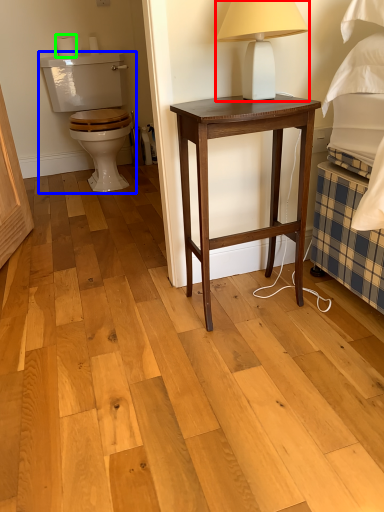
Question: Estimate the real-world distances between objects in this image. Which object is farther from table lamp (highlighted by a red box), armchair (highlighted by a blue box) or toilet paper (highlighted by a green box)?

Choices:
 (A) armchair
 (B) toilet paper

Answer: (B)